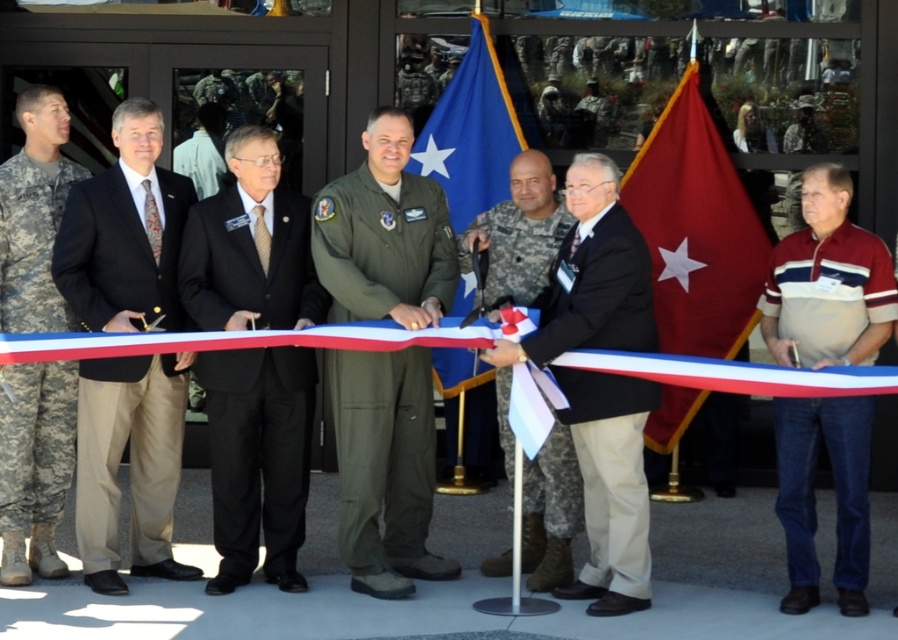
Can you confirm if black suit at left is shorter than maroon striped polo shirt at right?

Incorrect, black suit at left's height does not fall short of maroon striped polo shirt at right's.

Looking at this image, is black suit at left bigger than maroon striped polo shirt at right?

Correct, black suit at left is larger in size than maroon striped polo shirt at right.

Is point (134, 156) positioned behind point (807, 317)?

Yes, it is.

I want to click on black suit at left, so click(x=130, y=465).

Who is positioned more to the left, maroon striped polo shirt at right or camouflage fabric uniform at left?

camouflage fabric uniform at left

Is maroon striped polo shirt at right bigger than camouflage fabric uniform at left?

Yes.

The image size is (898, 640). Find the location of `maroon striped polo shirt at right`. maroon striped polo shirt at right is located at coordinates (826, 291).

Locate an element on the screen. This screenshot has width=898, height=640. maroon striped polo shirt at right is located at coordinates (826, 291).

Who is more distant from viewer, [349,540] or [750,209]?

Point [750,209]

Who is positioned more to the right, green uniform at center or red fabric flag at center?

From the viewer's perspective, red fabric flag at center appears more on the right side.

Is point (368, 136) farther from camera compared to point (702, 394)?

No, (368, 136) is in front of (702, 394).

Identify the location of green uniform at center. (385, 468).